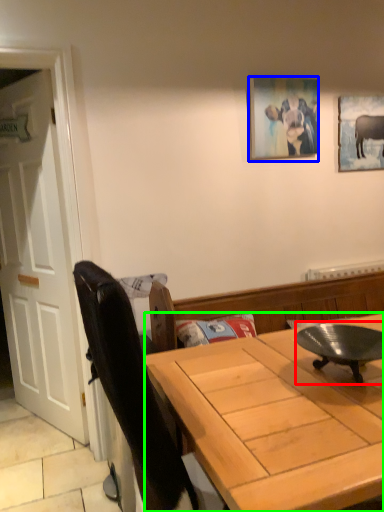
Question: Based on their relative distances, which object is nearer to round table (highlighted by a red box)? Choose from picture frame (highlighted by a blue box) and desk (highlighted by a green box).

Choices:
 (A) picture frame
 (B) desk

Answer: (B)